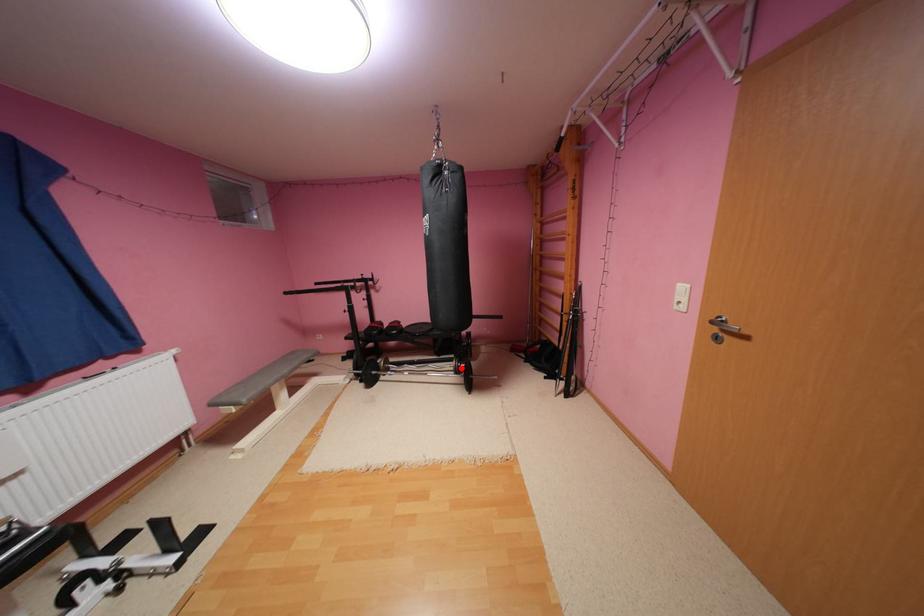
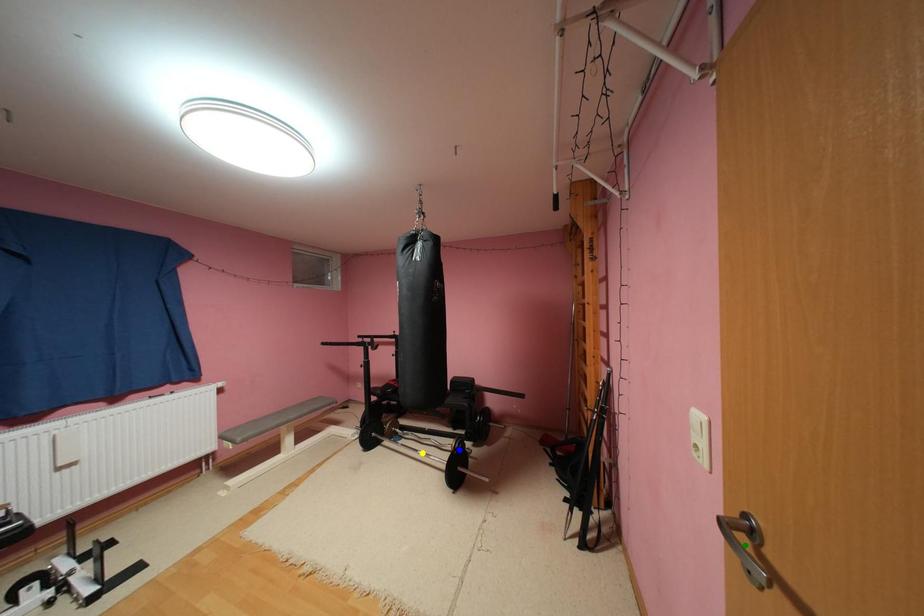
Question: I am providing you with two images of the same scene from different viewpoints. A red point is marked on the first image. You are given multiple points on the second image. Which mark in image 2 goes with the point in image 1?

Choices:
 (A) green point
 (B) yellow point
 (C) blue point

Answer: (C)